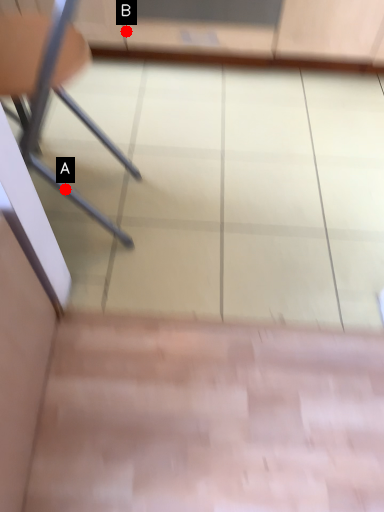
Question: Two points are circled on the image, labeled by A and B beside each circle. Which point is closer to the camera taking this photo?

Choices:
 (A) A is closer
 (B) B is closer

Answer: (A)